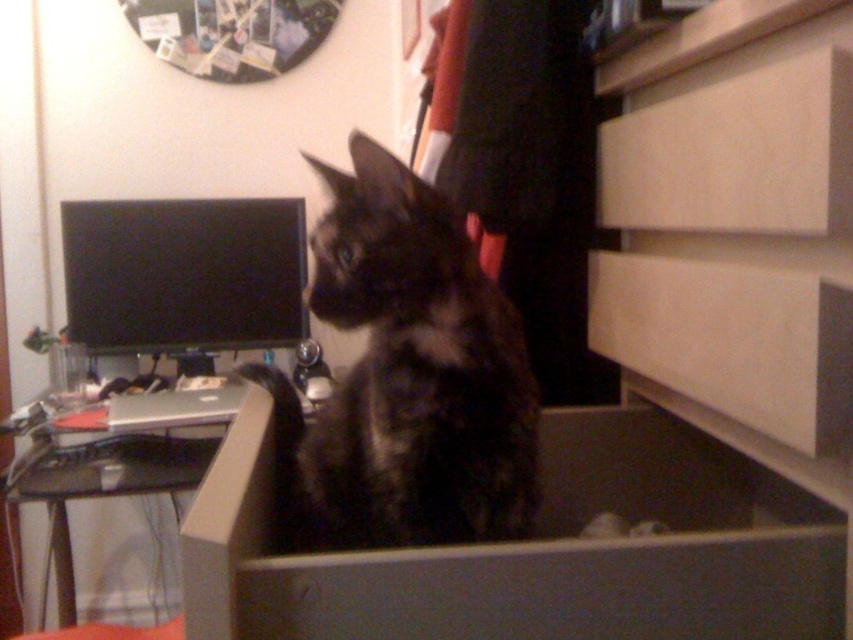
You are a delivery robot that needs to place a package between the white matte drawer at center right and the black glossy monitor at upper left. The package requires 1 meter of space. Can you fit it there?

The distance between the white matte drawer at center right and the black glossy monitor at upper left is 1.27 meters, which is more than enough to fit the package requiring 1 meter of space.

You are organizing your home and need to move the white matte drawer at center right and the black plastic computer desk at lower left to a smaller room. Which item should you move first to ensure both fit in the smaller room?

The white matte drawer at center right occupies less space than the black plastic computer desk at lower left, so you should move the white matte drawer at center right first to ensure both fit in the smaller room.